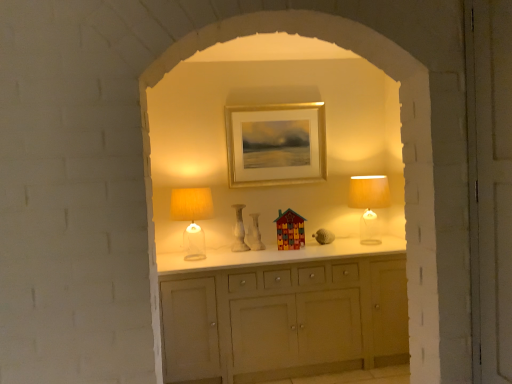
Question: Would you say white marble vase at center, the second vase from the right, is outside white glossy vase at center, which is counted as the 1th vase, starting from the right?

Choices:
 (A) yes
 (B) no

Answer: (A)

Question: From the image's perspective, is white marble vase at center, positioned as the first vase in left-to-right order, above white glossy vase at center, which is counted as the 1th vase, starting from the right?

Choices:
 (A) yes
 (B) no

Answer: (A)

Question: Can you confirm if white marble vase at center, the second vase from the right, is taller than white glossy vase at center, which is counted as the second vase, starting from the left?

Choices:
 (A) yes
 (B) no

Answer: (A)

Question: Is white marble vase at center, the second vase from the right, thinner than white glossy vase at center, which is counted as the 1th vase, starting from the right?

Choices:
 (A) no
 (B) yes

Answer: (B)

Question: Is white marble vase at center, positioned as the first vase in left-to-right order, in front of white glossy vase at center, which is counted as the second vase, starting from the left?

Choices:
 (A) yes
 (B) no

Answer: (A)

Question: Is white marble vase at center, the second vase from the right, beside white glossy vase at center, which is counted as the second vase, starting from the left?

Choices:
 (A) no
 (B) yes

Answer: (B)

Question: Is gold metallic picture frame at center next to white glossy vase at center, which is counted as the 1th vase, starting from the right?

Choices:
 (A) yes
 (B) no

Answer: (B)

Question: From the image's perspective, is gold metallic picture frame at center on top of white glossy vase at center, which is counted as the 1th vase, starting from the right?

Choices:
 (A) no
 (B) yes

Answer: (B)

Question: Is gold metallic picture frame at center to the right of white glossy vase at center, which is counted as the 1th vase, starting from the right, from the viewer's perspective?

Choices:
 (A) yes
 (B) no

Answer: (A)

Question: Would you say gold metallic picture frame at center is a long distance from white glossy vase at center, which is counted as the second vase, starting from the left?

Choices:
 (A) yes
 (B) no

Answer: (B)

Question: Does gold metallic picture frame at center have a larger size compared to white glossy vase at center, which is counted as the second vase, starting from the left?

Choices:
 (A) yes
 (B) no

Answer: (A)

Question: Is gold metallic picture frame at center wider than white glossy vase at center, which is counted as the second vase, starting from the left?

Choices:
 (A) no
 (B) yes

Answer: (A)

Question: Does translucent glass table lamp at right, marked as the second table lamp in a left-to-right arrangement, have a greater height compared to white marble vase at center, positioned as the first vase in left-to-right order?

Choices:
 (A) yes
 (B) no

Answer: (A)